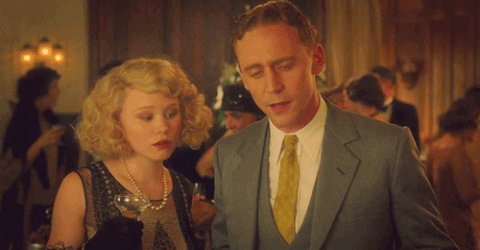
Identify the location of dark red drapes. This screenshot has height=250, width=480. (176, 32).